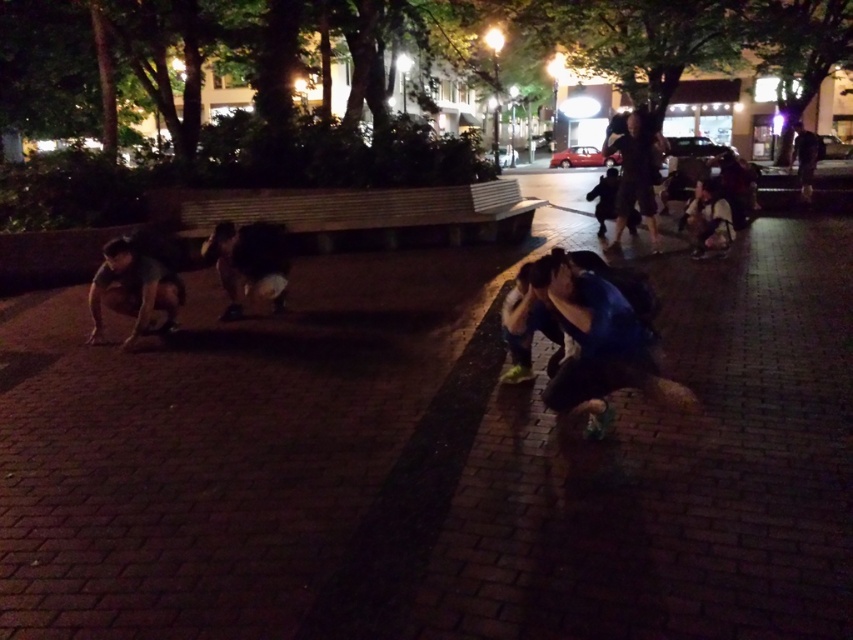
Which is more to the left, dark blue fabric pants at center or dark blue jeans at upper right?

From the viewer's perspective, dark blue fabric pants at center appears more on the left side.

Is dark blue fabric pants at center closer to camera compared to dark blue jeans at upper right?

That is True.

You are a GUI agent. You are given a task and a screenshot of the screen. Output one action in this format:
    pyautogui.click(x=<x>, y=<y>)
    Task: Click on the dark blue fabric pants at center
    Image resolution: width=853 pixels, height=640 pixels.
    Given the screenshot: What is the action you would take?
    pyautogui.click(x=248, y=262)

From the picture: Is blue fabric at lower right behind dark gray fabric pants at lower left?

No, it is not.

Between point (642, 355) and point (167, 282), which one is positioned behind?

The point (167, 282) is behind.

Between point (564, 321) and point (132, 310), which one is positioned in front?

Point (564, 321) is more forward.

The height and width of the screenshot is (640, 853). Find the location of `blue fabric at lower right`. blue fabric at lower right is located at coordinates (596, 342).

Locate an element on the screen. The height and width of the screenshot is (640, 853). dark blue fabric pants at center is located at coordinates (248, 262).

Is point (247, 253) positioned in front of point (614, 252)?

Yes, it is in front of point (614, 252).

The image size is (853, 640). What are the coordinates of `dark blue fabric pants at center` in the screenshot? It's located at (248, 262).